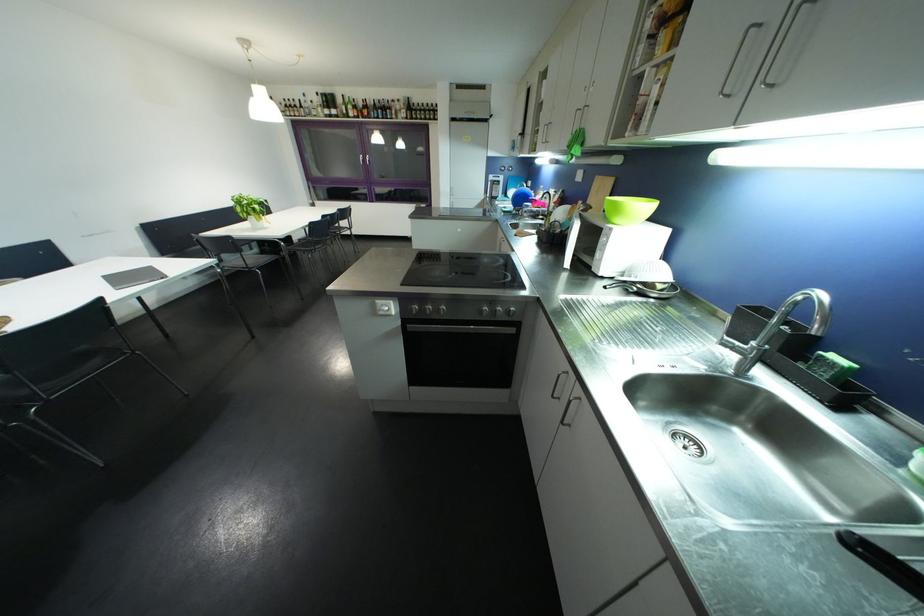
Locate an element on the screen. grey laptop is located at coordinates (132, 277).